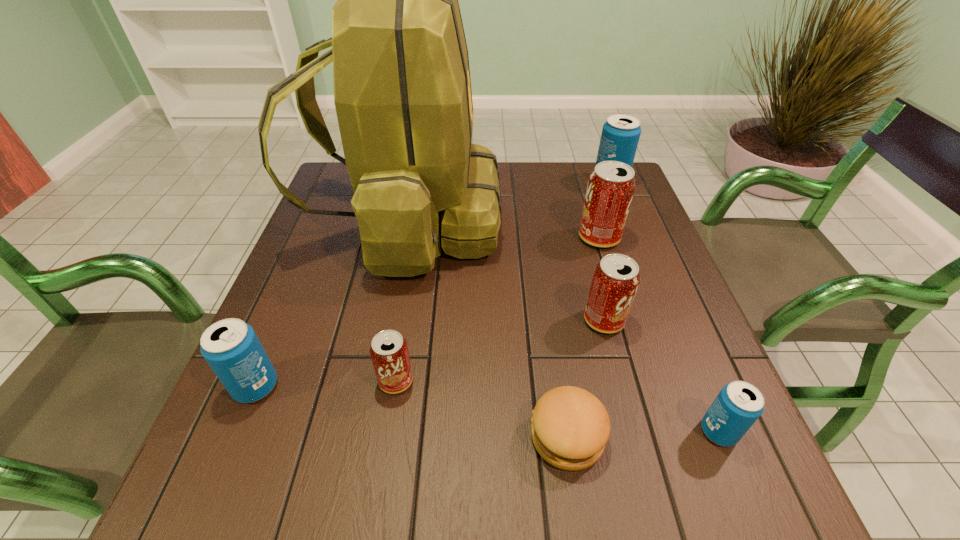
The width and height of the screenshot is (960, 540). Identify the location of blue soda can that is the closest to the second biggest blue soda can. (738, 405).

Identify the location of red soda can that can be found as the third closest to the farthest soda can. (389, 352).

In order to click on red soda can that is the second closest to the nearest blue soda can in this screenshot , I will do pyautogui.click(x=611, y=186).

At what (x,y) coordinates should I click in order to perform the action: click on free space that satisfies the following two spatial constraints: 1. on the front-facing side of the hamburger; 2. on the left side of the tallest object. Please return your answer as a coordinate pair (x, y). This screenshot has height=540, width=960. Looking at the image, I should click on (363, 436).

Identify the location of free region that satisfies the following two spatial constraints: 1. on the front-facing side of the tallest object; 2. on the left side of the nearest blue soda can. The image size is (960, 540). (364, 431).

Identify the location of vacant space that satisfies the following two spatial constraints: 1. on the back side of the shortest object; 2. on the right side of the biggest blue soda can. The width and height of the screenshot is (960, 540). (529, 181).

Identify the location of free location that satisfies the following two spatial constraints: 1. on the back side of the biggest red soda can; 2. on the left side of the second biggest red soda can. The width and height of the screenshot is (960, 540). (582, 238).

Identify the location of vacant region that satisfies the following two spatial constraints: 1. on the front-facing side of the backpack; 2. on the right side of the fourth object from left to right. (363, 436).

I want to click on free space that satisfies the following two spatial constraints: 1. on the back side of the leftmost soda can; 2. on the left side of the biggest red soda can, so click(318, 238).